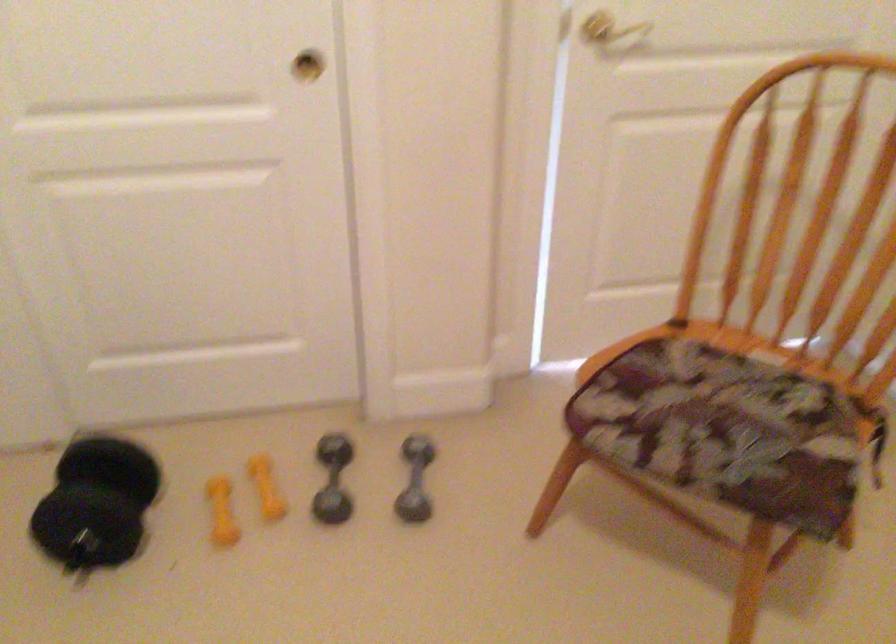
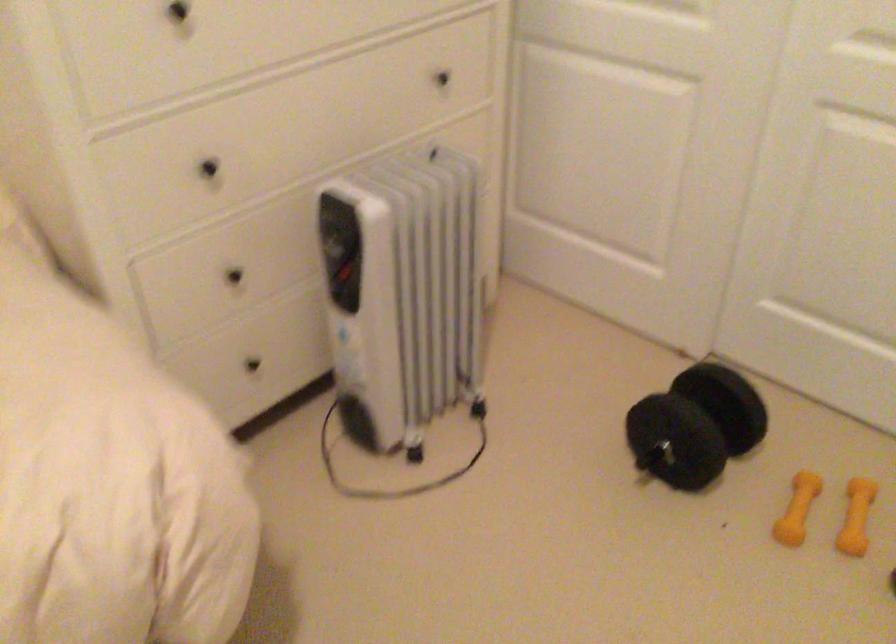
Locate, in the second image, the point that corresponds to [278,486] in the first image.

(856, 516)